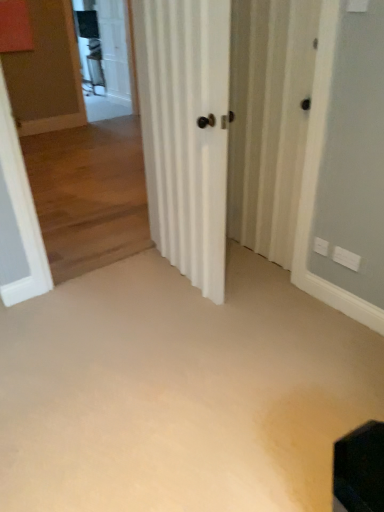
What do you see at coordinates (269, 120) in the screenshot? The width and height of the screenshot is (384, 512). I see `white striped screen door at center, which appears as the first screen door when viewed from the front` at bounding box center [269, 120].

Image resolution: width=384 pixels, height=512 pixels. I want to click on white matte door at center, so click(x=186, y=131).

From a real-world perspective, which screen door is the 1st one above the beige carpet at center? Please provide its 2D coordinates.

[(269, 120)]

Is beige carpet at center placed right next to white striped screen door at center, which is counted as the second screen door, starting from the back?

No, beige carpet at center is not next to white striped screen door at center, which is counted as the second screen door, starting from the back.

Who is more distant, beige carpet at center or white striped screen door at center, which is counted as the first screen door, starting from the bottom?

Positioned behind is white striped screen door at center, which is counted as the first screen door, starting from the bottom.

From a real-world perspective, is clear glass screen door at upper left, the 2th screen door in the right-to-left sequence, on top of beige carpet at center?

Yes.

Considering the positions of point (86, 53) and point (256, 294), is point (86, 53) closer or farther from the camera than point (256, 294)?

Point (86, 53) appears to be farther away from the viewer than point (256, 294).

Is beige carpet at center located within clear glass screen door at upper left, the 2th screen door when ordered from front to back?

No, beige carpet at center is not inside clear glass screen door at upper left, the 2th screen door when ordered from front to back.

From the image's perspective, would you say white matte door at center is shown under white striped screen door at center, which is counted as the second screen door, starting from the back?

Yes.

Considering the relative sizes of white matte door at center and white striped screen door at center, which is counted as the first screen door, starting from the bottom, in the image provided, is white matte door at center thinner than white striped screen door at center, which is counted as the first screen door, starting from the bottom,?

No.

Considering the sizes of objects white matte door at center and white striped screen door at center, which appears as the first screen door when viewed from the front, in the image provided, who is smaller, white matte door at center or white striped screen door at center, which appears as the first screen door when viewed from the front,?

Smaller between the two is white striped screen door at center, which appears as the first screen door when viewed from the front.

Considering the positions of points (114, 106) and (201, 24), is point (114, 106) farther from camera compared to point (201, 24)?

Yes, it is.

From a real-world perspective, is clear glass screen door at upper left, the 2th screen door from the bottom, below white matte door at center?

No, from a real-world perspective, clear glass screen door at upper left, the 2th screen door from the bottom, is not beneath white matte door at center.

Are clear glass screen door at upper left, which appears as the 1th screen door when viewed from the top, and white matte door at center located far from each other?

Yes, clear glass screen door at upper left, which appears as the 1th screen door when viewed from the top, and white matte door at center are quite far apart.

Who is smaller, clear glass screen door at upper left, the first screen door positioned from the left, or white matte door at center?

With smaller size is clear glass screen door at upper left, the first screen door positioned from the left.

From the image's perspective, is white striped screen door at center, acting as the 2th screen door starting from the left, positioned above or below clear glass screen door at upper left, the 2th screen door in the right-to-left sequence?

From the image's perspective, white striped screen door at center, acting as the 2th screen door starting from the left, appears below clear glass screen door at upper left, the 2th screen door in the right-to-left sequence.

Is clear glass screen door at upper left, which appears as the 1th screen door when viewed from the top, at the back of white striped screen door at center, which appears as the first screen door when viewed from the front?

No, white striped screen door at center, which appears as the first screen door when viewed from the front, is not facing the opposite direction of clear glass screen door at upper left, which appears as the 1th screen door when viewed from the top.

Which object is further away from the camera, white striped screen door at center, positioned as the second screen door in top-to-bottom order, or clear glass screen door at upper left, the 2th screen door in the right-to-left sequence?

Positioned behind is clear glass screen door at upper left, the 2th screen door in the right-to-left sequence.

Is white matte door at center aimed at clear glass screen door at upper left, the 2th screen door from the bottom?

No, white matte door at center is not oriented towards clear glass screen door at upper left, the 2th screen door from the bottom.

Can you see white matte door at center touching clear glass screen door at upper left, the first screen door positioned from the left?

white matte door at center and clear glass screen door at upper left, the first screen door positioned from the left, are not in contact.

Does point (198, 88) come closer to viewer compared to point (91, 24)?

Yes, point (198, 88) is in front of point (91, 24).

In terms of width, does white matte door at center look wider or thinner when compared to clear glass screen door at upper left, the first screen door positioned from the left?

In the image, white matte door at center appears to be wider than clear glass screen door at upper left, the first screen door positioned from the left.

Based on their sizes in the image, would you say clear glass screen door at upper left, the first screen door positioned from the left, is bigger or smaller than white striped screen door at center, positioned as the second screen door in top-to-bottom order?

Clearly, clear glass screen door at upper left, the first screen door positioned from the left, is larger in size than white striped screen door at center, positioned as the second screen door in top-to-bottom order.

Is clear glass screen door at upper left, the first screen door positioned from the left, positioned far away from white striped screen door at center, the first screen door viewed from the right?

Yes, clear glass screen door at upper left, the first screen door positioned from the left, and white striped screen door at center, the first screen door viewed from the right, are located far from each other.

From the image's perspective, is clear glass screen door at upper left, the 1th screen door from the back, located above or below white striped screen door at center, which is counted as the first screen door, starting from the bottom?

Clearly, from the image's perspective, clear glass screen door at upper left, the 1th screen door from the back, is above white striped screen door at center, which is counted as the first screen door, starting from the bottom.

From a real-world perspective, which screen door is the 1st one above the beige carpet at center? Please provide its 2D coordinates.

[(269, 120)]

This screenshot has height=512, width=384. I want to click on the 2nd screen door behind the beige carpet at center, starting your count from the anchor, so click(107, 52).

Estimate the real-world distances between objects in this image. Which object is closer to beige carpet at center, white striped screen door at center, positioned as the second screen door in top-to-bottom order, or clear glass screen door at upper left, the 2th screen door when ordered from front to back?

white striped screen door at center, positioned as the second screen door in top-to-bottom order, lies closer to beige carpet at center than the other object.

When comparing their distances from beige carpet at center, does clear glass screen door at upper left, the 2th screen door in the right-to-left sequence, or white striped screen door at center, which is counted as the first screen door, starting from the bottom, seem closer?

white striped screen door at center, which is counted as the first screen door, starting from the bottom, is closer to beige carpet at center.

Looking at the image, which one is located further to clear glass screen door at upper left, the 2th screen door from the bottom, white striped screen door at center, which appears as the first screen door when viewed from the front, or white matte door at center?

The object further to clear glass screen door at upper left, the 2th screen door from the bottom, is white matte door at center.

Which object lies further to the anchor point beige carpet at center, white matte door at center or white striped screen door at center, which is counted as the second screen door, starting from the back?

Among the two, white striped screen door at center, which is counted as the second screen door, starting from the back, is located further to beige carpet at center.

Based on their spatial positions, is beige carpet at center or clear glass screen door at upper left, which appears as the 1th screen door when viewed from the top, closer to white striped screen door at center, which is counted as the first screen door, starting from the bottom?

Based on the image, beige carpet at center appears to be nearer to white striped screen door at center, which is counted as the first screen door, starting from the bottom.

Looking at the image, which one is located further to clear glass screen door at upper left, the 1th screen door from the back, beige carpet at center or white matte door at center?

beige carpet at center is further to clear glass screen door at upper left, the 1th screen door from the back.

When comparing their distances from white striped screen door at center, which is counted as the first screen door, starting from the bottom, does white matte door at center or clear glass screen door at upper left, the 2th screen door from the bottom, seem closer?

white matte door at center lies closer to white striped screen door at center, which is counted as the first screen door, starting from the bottom, than the other object.

Based on their spatial positions, is white striped screen door at center, which is counted as the second screen door, starting from the back, or beige carpet at center further from white matte door at center?

The object further to white matte door at center is beige carpet at center.

The image size is (384, 512). Find the location of `door between beige carpet at center and clear glass screen door at upper left, the first screen door positioned from the left, from front to back`. door between beige carpet at center and clear glass screen door at upper left, the first screen door positioned from the left, from front to back is located at coordinates (186, 131).

I want to click on screen door located between beige carpet at center and clear glass screen door at upper left, the first screen door positioned from the left, in the depth direction, so click(269, 120).

Locate an element on the screen. door between white striped screen door at center, positioned as the second screen door in top-to-bottom order, and beige carpet at center vertically is located at coordinates (186, 131).

I want to click on screen door between white matte door at center and clear glass screen door at upper left, the 2th screen door from the bottom, along the z-axis, so click(269, 120).